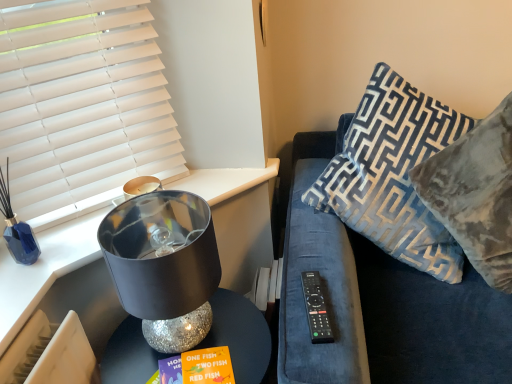
Question: Considering the relative positions of shiny metallic lamp at left and velvet blue couch at right in the image provided, is shiny metallic lamp at left to the left of velvet blue couch at right from the viewer's perspective?

Choices:
 (A) yes
 (B) no

Answer: (A)

Question: Can you confirm if shiny metallic lamp at left is positioned to the right of velvet blue couch at right?

Choices:
 (A) no
 (B) yes

Answer: (A)

Question: Considering the relative sizes of shiny metallic lamp at left and velvet blue couch at right in the image provided, is shiny metallic lamp at left taller than velvet blue couch at right?

Choices:
 (A) no
 (B) yes

Answer: (A)

Question: Does shiny metallic lamp at left have a lesser height compared to velvet blue couch at right?

Choices:
 (A) no
 (B) yes

Answer: (B)

Question: Is shiny metallic lamp at left directly adjacent to velvet blue couch at right?

Choices:
 (A) no
 (B) yes

Answer: (A)

Question: Is shiny metallic lamp at left outside of velvet blue couch at right?

Choices:
 (A) no
 (B) yes

Answer: (B)

Question: Can you confirm if shiny metallic lampshade at left is positioned to the left of white matte window blind at upper left?

Choices:
 (A) yes
 (B) no

Answer: (B)

Question: Can you confirm if shiny metallic lampshade at left is positioned to the right of white matte window blind at upper left?

Choices:
 (A) no
 (B) yes

Answer: (B)

Question: Is shiny metallic lampshade at left positioned beyond the bounds of white matte window blind at upper left?

Choices:
 (A) yes
 (B) no

Answer: (A)

Question: Considering the relative sizes of shiny metallic lampshade at left and white matte window blind at upper left in the image provided, is shiny metallic lampshade at left thinner than white matte window blind at upper left?

Choices:
 (A) yes
 (B) no

Answer: (B)

Question: Does shiny metallic lampshade at left have a greater width compared to white matte window blind at upper left?

Choices:
 (A) no
 (B) yes

Answer: (B)

Question: Is white matte window blind at upper left at the back of shiny metallic lampshade at left?

Choices:
 (A) yes
 (B) no

Answer: (B)

Question: Is black plastic remote at right positioned beyond the bounds of white matte window blind at upper left?

Choices:
 (A) no
 (B) yes

Answer: (B)